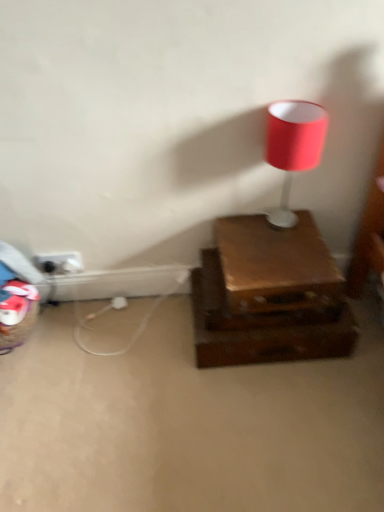
This screenshot has height=512, width=384. What are the coordinates of `black plastic outlet at lower left` in the screenshot? It's located at (60, 262).

This screenshot has width=384, height=512. In order to click on shiny brown drawer at center in this screenshot , I will do `click(269, 296)`.

Where is `lamp above the black plastic outlet at lower left (from a real-world perspective)`? The height and width of the screenshot is (512, 384). lamp above the black plastic outlet at lower left (from a real-world perspective) is located at coordinates (293, 147).

Is black plastic outlet at lower left taller or shorter than matte red lampshade at upper right?

black plastic outlet at lower left is shorter than matte red lampshade at upper right.

Is point (77, 261) less distant than point (266, 146)?

That is False.

Considering their positions, is black plastic outlet at lower left located in front of or behind matte red lampshade at upper right?

black plastic outlet at lower left is positioned farther from the viewer than matte red lampshade at upper right.

How different are the orientations of matte red lampshade at upper right and black plastic outlet at lower left in degrees?

0.000916 degrees.

Is matte red lampshade at upper right wider or thinner than black plastic outlet at lower left?

Clearly, matte red lampshade at upper right has more width compared to black plastic outlet at lower left.

Would you say matte red lampshade at upper right contains black plastic outlet at lower left?

No, black plastic outlet at lower left is not inside matte red lampshade at upper right.

Considering the relative positions of matte red lampshade at upper right and black plastic outlet at lower left in the image provided, is matte red lampshade at upper right to the left or to the right of black plastic outlet at lower left?

Clearly, matte red lampshade at upper right is on the right of black plastic outlet at lower left in the image.

What's the angular difference between shiny brown drawer at center and black plastic outlet at lower left's facing directions?

1.13 degrees separate the facing orientations of shiny brown drawer at center and black plastic outlet at lower left.

Is shiny brown drawer at center oriented away from black plastic outlet at lower left?

No.

Where is `electric outlet that is behind the shiny brown drawer at center`? This screenshot has width=384, height=512. electric outlet that is behind the shiny brown drawer at center is located at coordinates (60, 262).

Are shiny brown drawer at center and black plastic outlet at lower left making contact?

No.

At what (x,y) coordinates should I click in order to perform the action: click on lamp located above the shiny brown drawer at center (from the image's perspective). Please return your answer as a coordinate pair (x, y). Image resolution: width=384 pixels, height=512 pixels. Looking at the image, I should click on (293, 147).

Does point (351, 338) lie behind point (305, 116)?

Yes, it is.

Does shiny brown drawer at center touch matte red lampshade at upper right?

There is a gap between shiny brown drawer at center and matte red lampshade at upper right.

Would you say matte red lampshade at upper right is part of shiny brown drawer at center's contents?

No, matte red lampshade at upper right is not inside shiny brown drawer at center.

Considering the relative positions of matte red lampshade at upper right and shiny brown drawer at center in the image provided, is matte red lampshade at upper right to the right of shiny brown drawer at center from the viewer's perspective?

Correct, you'll find matte red lampshade at upper right to the right of shiny brown drawer at center.

Is point (271, 217) closer to camera compared to point (337, 337)?

No.

Does matte red lampshade at upper right have a smaller size compared to shiny brown drawer at center?

Yes.

Are black plastic outlet at lower left and shiny brown drawer at center beside each other?

black plastic outlet at lower left is not next to shiny brown drawer at center, and they're not touching.

Based on their positions, is black plastic outlet at lower left located to the left or right of shiny brown drawer at center?

Based on their positions, black plastic outlet at lower left is located to the left of shiny brown drawer at center.

Is black plastic outlet at lower left shorter than shiny brown drawer at center?

Yes.

The width and height of the screenshot is (384, 512). What are the coordinates of `lamp above the black plastic outlet at lower left (from the image's perspective)` in the screenshot? It's located at (293, 147).

Find the location of a particular element. lamp positioned vertically above the black plastic outlet at lower left (from a real-world perspective) is located at coordinates (293, 147).

Which object lies further to the anchor point matte red lampshade at upper right, shiny brown drawer at center or black plastic outlet at lower left?

black plastic outlet at lower left lies further to matte red lampshade at upper right than the other object.

Which object lies nearer to the anchor point matte red lampshade at upper right, black plastic outlet at lower left or shiny brown drawer at center?

Based on the image, shiny brown drawer at center appears to be nearer to matte red lampshade at upper right.

Considering their positions, is matte red lampshade at upper right positioned closer to black plastic outlet at lower left than shiny brown drawer at center?

The object closer to black plastic outlet at lower left is shiny brown drawer at center.

Looking at the image, which one is located closer to shiny brown drawer at center, black plastic outlet at lower left or matte red lampshade at upper right?

Based on the image, matte red lampshade at upper right appears to be nearer to shiny brown drawer at center.

When comparing their distances from shiny brown drawer at center, does matte red lampshade at upper right or black plastic outlet at lower left seem closer?

matte red lampshade at upper right is closer to shiny brown drawer at center.

When comparing their distances from black plastic outlet at lower left, does shiny brown drawer at center or matte red lampshade at upper right seem closer?

shiny brown drawer at center.

I want to click on furniture situated between black plastic outlet at lower left and matte red lampshade at upper right from left to right, so click(x=269, y=296).